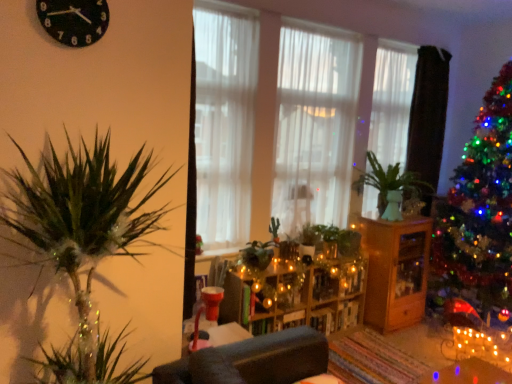
Question: Would you say black plastic clock at upper left is inside or outside wooden shelves at center?

Choices:
 (A) outside
 (B) inside

Answer: (A)

Question: Considering the positions of black plastic clock at upper left and wooden shelves at center in the image, is black plastic clock at upper left bigger or smaller than wooden shelves at center?

Choices:
 (A) small
 (B) big

Answer: (A)

Question: Considering the real-world distances, which object is farthest from the transparent glass vase at center-right?

Choices:
 (A) green matte vase at center
 (B) green matte plant at center
 (C) wooden shelves at center
 (D) white sheer curtain at center, which ranks as the third curtain in right-to-left order
 (E) black plastic clock at upper left

Answer: (E)

Question: Estimate the real-world distances between objects in this image. Which object is closer to the wooden shelves at center?

Choices:
 (A) black plastic clock at upper left
 (B) white sheer curtain at center, the first curtain viewed from the right
 (C) green matte plant at center
 (D) wooden cabinet at center
 (E) transparent glass vase at center-right

Answer: (C)